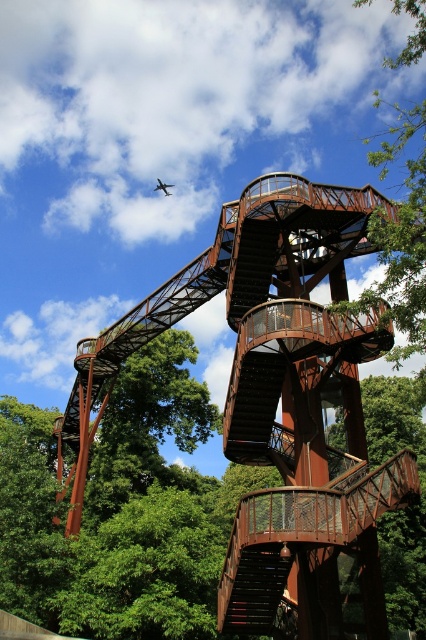
Who is lower down, green leafy tree at upper right or rusty metal staircase at center?

rusty metal staircase at center is lower down.

Is green leafy tree at upper right wider than rusty metal staircase at center?

Correct, the width of green leafy tree at upper right exceeds that of rusty metal staircase at center.

Between point (385, 291) and point (241, 296), which one is positioned behind?

The point (241, 296) is more distant.

Locate an element on the screen. The image size is (426, 640). green leafy tree at upper right is located at coordinates (402, 232).

Consider the image. Is rusty metal staircase at center above metallic silver airplane at upper center?

Incorrect, rusty metal staircase at center is not positioned above metallic silver airplane at upper center.

Locate an element on the screen. rusty metal staircase at center is located at coordinates (250, 266).

Who is more distant from viewer, (287, 548) or (265, 230)?

The point (265, 230) is more distant.

Who is taller, rustic metal staircase at center or rusty metal staircase at center?

Standing taller between the two is rustic metal staircase at center.

Who is more distant from viewer, (244, 625) or (239, 250)?

The point (239, 250) is more distant.

This screenshot has height=640, width=426. Identify the location of rustic metal staircase at center. (252, 588).